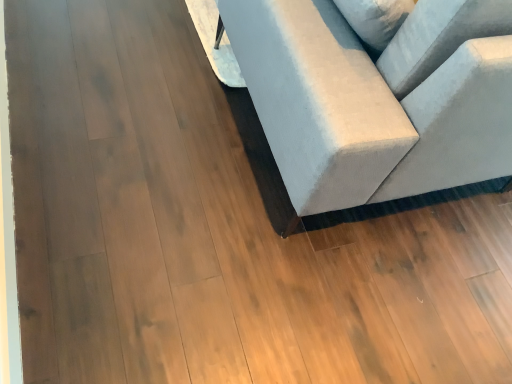
At what (x,y) coordinates should I click in order to perform the action: click on free space to the left of suede-like gray couch at lower right. Please return your answer as a coordinate pair (x, y). This screenshot has height=384, width=512. Looking at the image, I should click on (121, 79).